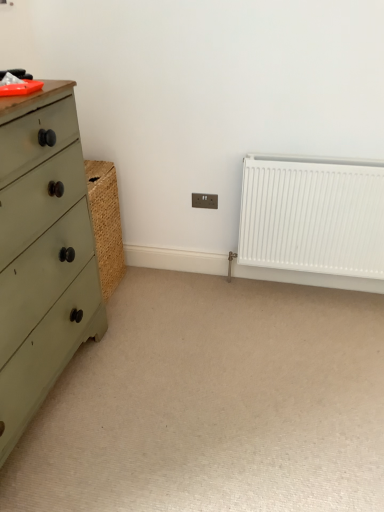
Question: Is white matte radiator at right oriented towards beige carpet at center?

Choices:
 (A) yes
 (B) no

Answer: (A)

Question: Does white matte radiator at right appear on the right side of beige carpet at center?

Choices:
 (A) no
 (B) yes

Answer: (B)

Question: Is white matte radiator at right further to the viewer compared to beige carpet at center?

Choices:
 (A) no
 (B) yes

Answer: (B)

Question: Can you confirm if white matte radiator at right is bigger than beige carpet at center?

Choices:
 (A) no
 (B) yes

Answer: (B)

Question: Does white matte radiator at right have a greater width compared to beige carpet at center?

Choices:
 (A) no
 (B) yes

Answer: (A)

Question: In terms of size, does green matte chest of drawers at left appear bigger or smaller than beige carpet at center?

Choices:
 (A) big
 (B) small

Answer: (A)

Question: From the image's perspective, is green matte chest of drawers at left located above or below beige carpet at center?

Choices:
 (A) above
 (B) below

Answer: (A)

Question: From their relative heights in the image, would you say green matte chest of drawers at left is taller or shorter than beige carpet at center?

Choices:
 (A) tall
 (B) short

Answer: (A)

Question: Considering the positions of green matte chest of drawers at left and beige carpet at center in the image, is green matte chest of drawers at left wider or thinner than beige carpet at center?

Choices:
 (A) thin
 (B) wide

Answer: (A)

Question: Does point (210, 203) appear closer or farther from the camera than point (34, 273)?

Choices:
 (A) closer
 (B) farther

Answer: (B)

Question: From a real-world perspective, is brown plastic electric outlet at center positioned above or below green matte chest of drawers at left?

Choices:
 (A) above
 (B) below

Answer: (B)

Question: Considering the positions of brown plastic electric outlet at center and green matte chest of drawers at left in the image, is brown plastic electric outlet at center wider or thinner than green matte chest of drawers at left?

Choices:
 (A) thin
 (B) wide

Answer: (A)

Question: Considering the relative positions of brown plastic electric outlet at center and green matte chest of drawers at left in the image provided, is brown plastic electric outlet at center to the left or to the right of green matte chest of drawers at left?

Choices:
 (A) left
 (B) right

Answer: (B)

Question: In terms of height, does green matte chest of drawers at left look taller or shorter compared to brown plastic electric outlet at center?

Choices:
 (A) tall
 (B) short

Answer: (A)

Question: From a real-world perspective, is green matte chest of drawers at left above or below brown plastic electric outlet at center?

Choices:
 (A) above
 (B) below

Answer: (A)